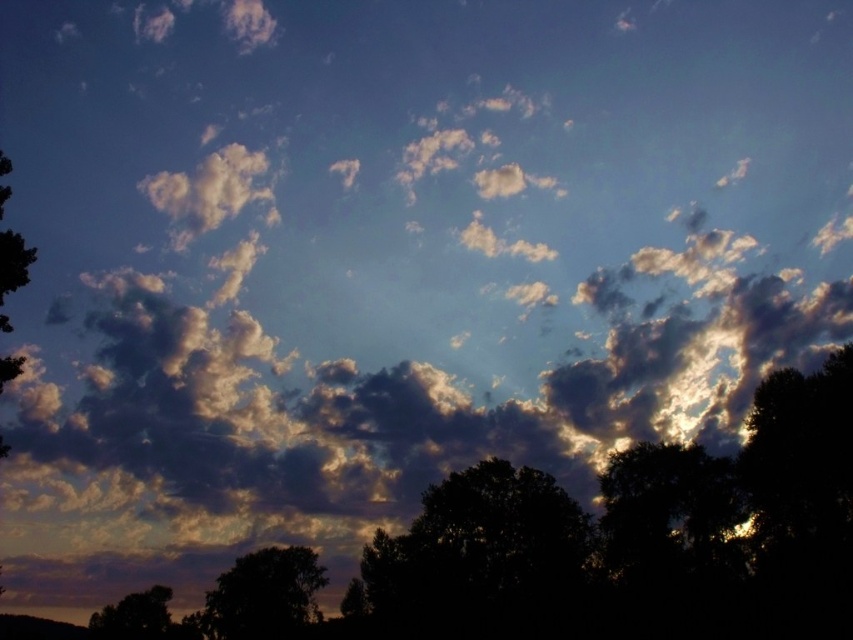
Is silhouette tree at lower center smaller than silhouette tree at lower left?

Yes, silhouette tree at lower center is smaller than silhouette tree at lower left.

Which is more to the left, silhouette tree at lower center or silhouette tree at lower left?

From the viewer's perspective, silhouette tree at lower left appears more on the left side.

Locate an element on the screen. Image resolution: width=853 pixels, height=640 pixels. silhouette tree at lower center is located at coordinates (264, 595).

Find the location of a particular element. silhouette tree at lower center is located at coordinates (264, 595).

Looking at this image, between dark silhouette tree at center and silhouette tree at lower left, which one is positioned lower?

silhouette tree at lower left

Which is in front, point (525, 598) or point (160, 593)?

Point (525, 598) is in front.

Does point (503, 580) lie behind point (134, 628)?

No, (503, 580) is in front of (134, 628).

Locate an element on the screen. dark silhouette tree at center is located at coordinates (479, 560).

Between silhouette tree at center and silhouette tree at lower left, which one has less height?

silhouette tree at lower left

Does silhouette tree at center appear on the left side of silhouette tree at lower left?

No, silhouette tree at center is not to the left of silhouette tree at lower left.

Which is behind, point (763, 596) or point (169, 630)?

Positioned behind is point (169, 630).

Find the location of a particular element. silhouette tree at center is located at coordinates (599, 545).